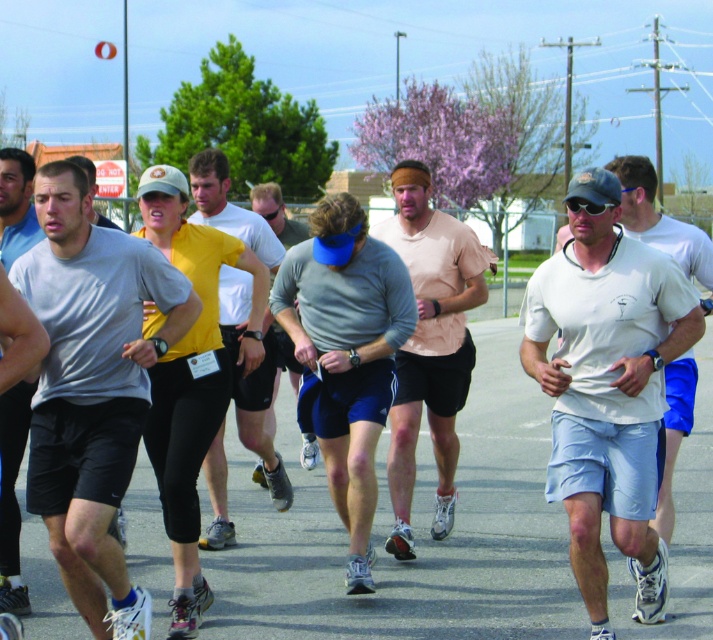
You are a photographer standing at the starting line of the race. You want to capture a photo of the runner wearing the gray matte shorts at center. Where should you aim your camera to ensure the shorts are in the frame?

You should aim your camera at point (11, 493) to capture the gray matte shorts at center in the frame.

Based on the photo, you are a participant in the running event and you see a point marked at coordinates (92, 388). What object is this point located on?

The point is located on the gray matte t shirt at center.